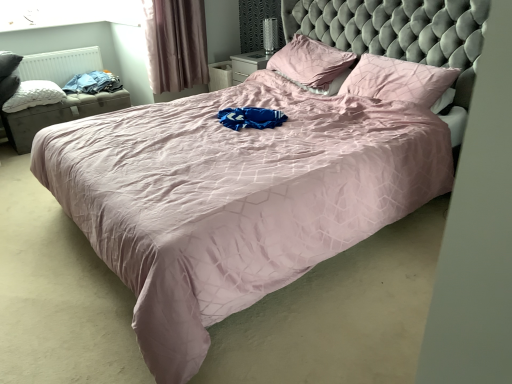
Find the location of a particular element. This screenshot has width=512, height=384. vacant region above white matte radiator at left (from a real-world perspective) is located at coordinates (45, 51).